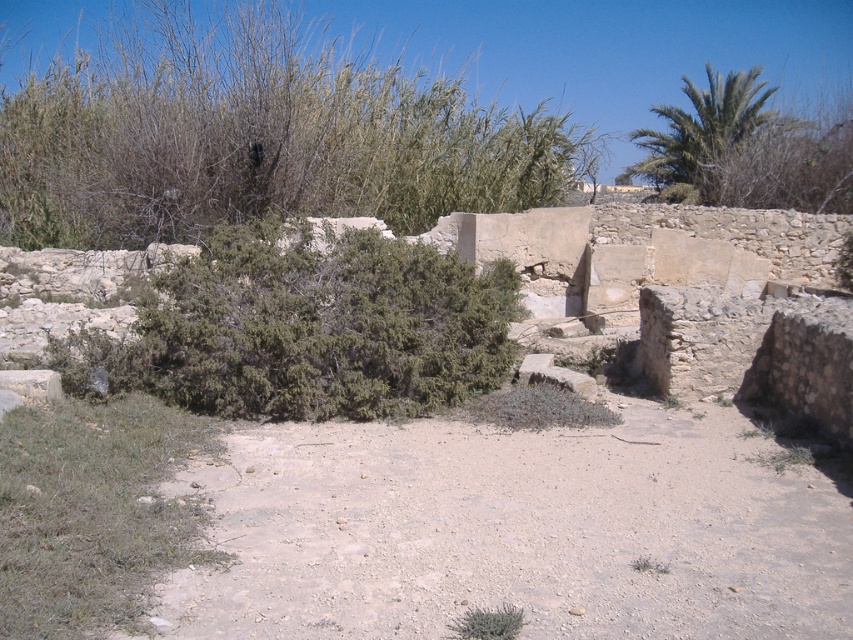
Between point (108, 220) and point (492, 637), which one is positioned in front?

Positioned in front is point (492, 637).

Between green leafy bush at upper left and green leafy bush at lower center, which one is positioned higher?

Positioned higher is green leafy bush at upper left.

You are a GUI agent. You are given a task and a screenshot of the screen. Output one action in this format:
    pyautogui.click(x=<x>, y=<y>)
    Task: Click on the green leafy bush at upper left
    The image size is (853, 640).
    Given the screenshot: What is the action you would take?
    pyautogui.click(x=257, y=134)

You are a GUI agent. You are given a task and a screenshot of the screen. Output one action in this format:
    pyautogui.click(x=<x>, y=<y>)
    Task: Click on the green leafy bush at upper left
    The height and width of the screenshot is (640, 853).
    Given the screenshot: What is the action you would take?
    pyautogui.click(x=257, y=134)

Who is more distant from viewer, (720, 147) or (463, 637)?

The point (720, 147) is behind.

Is green leafy palm at upper right bigger than green leafy bush at lower center?

Indeed, green leafy palm at upper right has a larger size compared to green leafy bush at lower center.

Does point (670, 192) come in front of point (457, 621)?

No, (670, 192) is further to viewer.

Locate an element on the screen. The image size is (853, 640). green leafy palm at upper right is located at coordinates (701, 134).

Who is lower down, green leafy bush at upper left or green shrub at center?

green shrub at center

The width and height of the screenshot is (853, 640). Describe the element at coordinates (257, 134) in the screenshot. I see `green leafy bush at upper left` at that location.

The width and height of the screenshot is (853, 640). I want to click on green leafy bush at upper left, so click(257, 134).